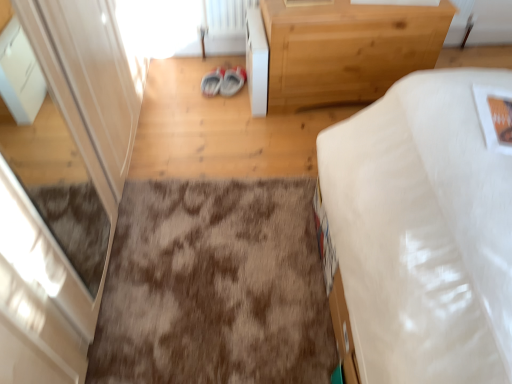
Question: Is matte gray sneakers at center at the right side of white glossy screen door at left?

Choices:
 (A) no
 (B) yes

Answer: (B)

Question: Considering the relative sizes of matte gray sneakers at center and white glossy screen door at left in the image provided, is matte gray sneakers at center shorter than white glossy screen door at left?

Choices:
 (A) no
 (B) yes

Answer: (B)

Question: From the image's perspective, is matte gray sneakers at center below white glossy screen door at left?

Choices:
 (A) no
 (B) yes

Answer: (A)

Question: Is matte gray sneakers at center to the left of white glossy screen door at left from the viewer's perspective?

Choices:
 (A) no
 (B) yes

Answer: (A)

Question: Is white glossy screen door at left inside matte gray sneakers at center?

Choices:
 (A) no
 (B) yes

Answer: (A)

Question: Considering the positions of white glossy cabinet at upper center and brown shaggy rug at center in the image, is white glossy cabinet at upper center taller or shorter than brown shaggy rug at center?

Choices:
 (A) tall
 (B) short

Answer: (A)

Question: Based on their sizes in the image, would you say white glossy cabinet at upper center is bigger or smaller than brown shaggy rug at center?

Choices:
 (A) big
 (B) small

Answer: (B)

Question: Relative to brown shaggy rug at center, is white glossy cabinet at upper center in front or behind?

Choices:
 (A) behind
 (B) front

Answer: (A)

Question: Which is correct: white glossy cabinet at upper center is inside brown shaggy rug at center, or outside of it?

Choices:
 (A) inside
 (B) outside

Answer: (B)

Question: Is brown shaggy rug at center bigger or smaller than light wood/texture chest of drawers at upper right?

Choices:
 (A) big
 (B) small

Answer: (B)

Question: From a real-world perspective, relative to light wood/texture chest of drawers at upper right, is brown shaggy rug at center vertically above or below?

Choices:
 (A) below
 (B) above

Answer: (A)

Question: Choose the correct answer: Is brown shaggy rug at center inside light wood/texture chest of drawers at upper right or outside it?

Choices:
 (A) inside
 (B) outside

Answer: (B)

Question: In terms of height, does brown shaggy rug at center look taller or shorter compared to light wood/texture chest of drawers at upper right?

Choices:
 (A) tall
 (B) short

Answer: (B)

Question: Considering their positions, is white glossy screen door at left located in front of or behind white glossy cabinet at upper center?

Choices:
 (A) behind
 (B) front

Answer: (B)

Question: Considering the positions of white glossy screen door at left and white glossy cabinet at upper center in the image, is white glossy screen door at left taller or shorter than white glossy cabinet at upper center?

Choices:
 (A) short
 (B) tall

Answer: (B)